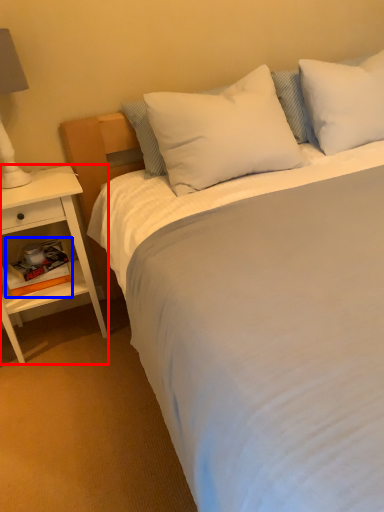
Question: Which object appears closest to the camera in this image, nightstand (highlighted by a red box) or book (highlighted by a blue box)?

Choices:
 (A) nightstand
 (B) book

Answer: (A)